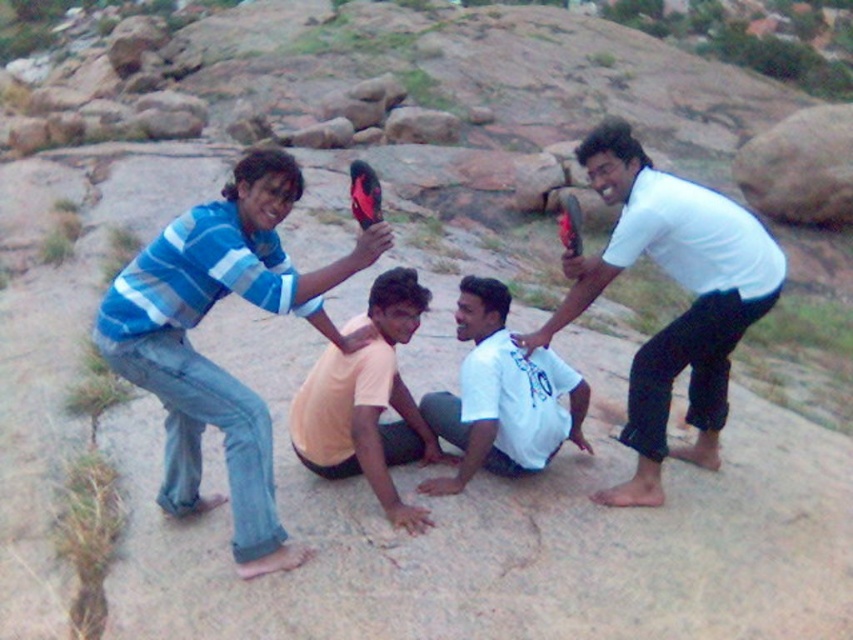
Where is the blue striped shirt at upper left located in the image?

The blue striped shirt at upper left is located at point coordinates of (207,358).

You are standing at the base of the rocky terrain and want to hand a water bottle to the person wearing the orange cotton shirt at center. Which direction should you move to reach them first without passing by the white matte shirt at upper right?

Since the white matte shirt at upper right is located above the orange cotton shirt at center, you should move downward towards the orange cotton shirt at center to reach them first without passing by the white matte shirt at upper right.

From the picture: You are trying to decide which of the two shirts you can wear for a hiking trip. The blue striped shirt at upper left and the white cotton shirt at center are both available. If you prefer a larger size, which one should you choose?

The blue striped shirt at upper left is bigger than the white cotton shirt at center, so you should choose the blue striped shirt at upper left for a larger size.